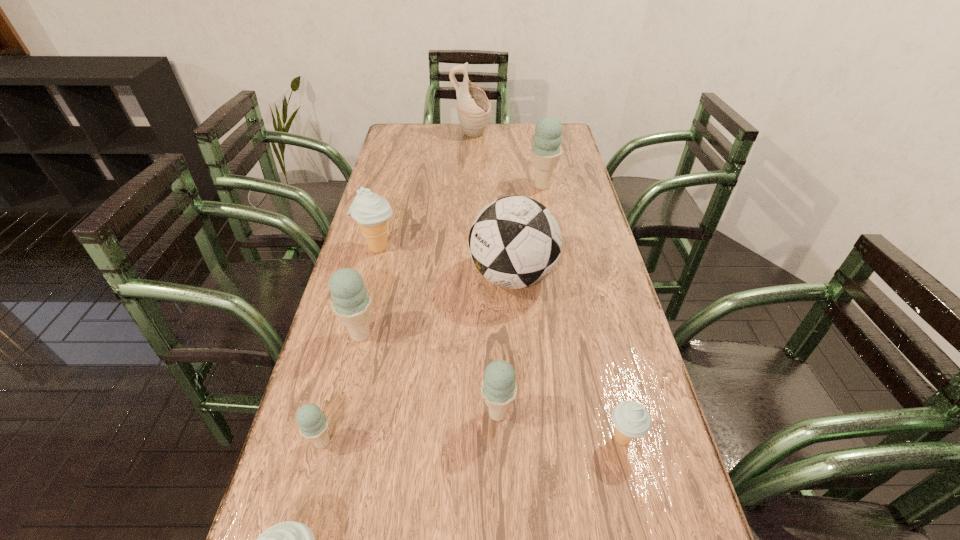
The width and height of the screenshot is (960, 540). In order to click on vacant space situated 0.220m on the right of the second smallest blue ice cream in this screenshot , I will do `click(619, 413)`.

Where is `free space located on the left of the second farthest beige icecream`? This screenshot has height=540, width=960. free space located on the left of the second farthest beige icecream is located at coordinates (530, 439).

Find the location of a particular element. The height and width of the screenshot is (540, 960). free location located 0.090m on the front of the smallest blue ice cream is located at coordinates (306, 504).

At what (x,y) coordinates should I click in order to perform the action: click on object that is positioned at the far edge. Please return your answer as a coordinate pair (x, y). This screenshot has height=540, width=960. Looking at the image, I should click on (473, 107).

Find the location of `free region at the far edge of the desktop`. free region at the far edge of the desktop is located at coordinates (473, 141).

Locate an element on the screen. free space at the left edge of the desktop is located at coordinates (401, 263).

Where is `free space at the right edge of the desktop`? free space at the right edge of the desktop is located at coordinates (586, 224).

Locate an element on the screen. This screenshot has height=540, width=960. free point between the black soccer ball and the farthest beige icecream is located at coordinates (445, 262).

This screenshot has width=960, height=540. I want to click on vacant region between the farthest ice cream and the farthest object, so click(x=507, y=160).

In order to click on empty space between the second farthest ice cream and the smallest blue ice cream in this screenshot , I will do `click(350, 345)`.